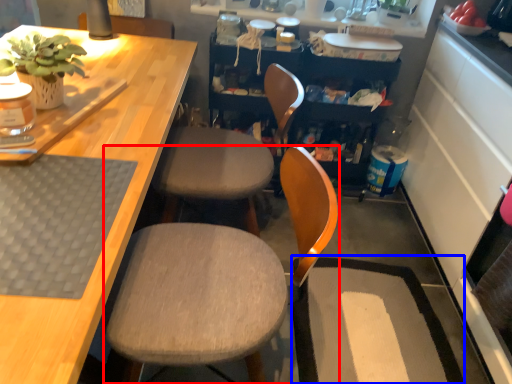
Question: Which point is closer to the camera, chair (highlighted by a red box) or wide (highlighted by a blue box)?

Choices:
 (A) chair
 (B) wide

Answer: (A)